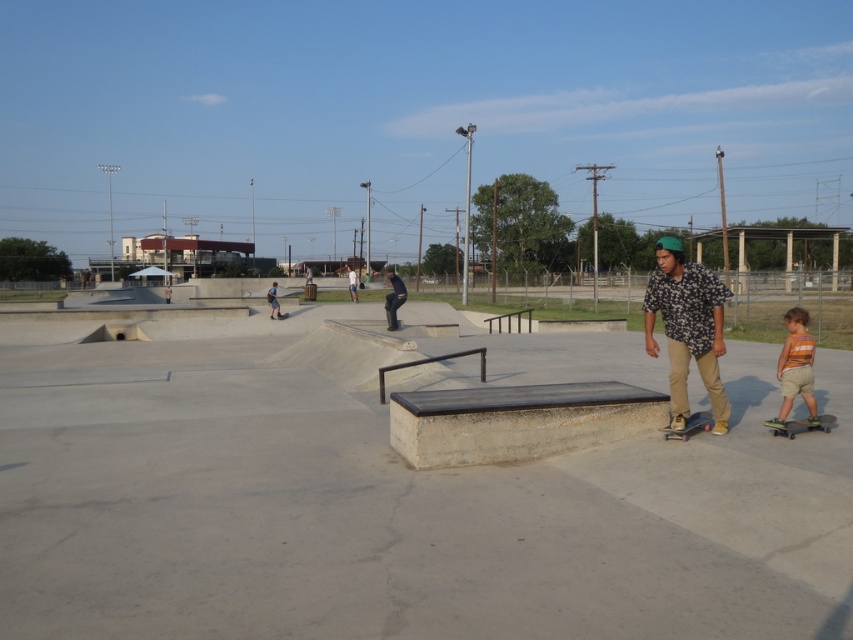
Question: Which of the following is the farthest from the observer?

Choices:
 (A) concrete skate park at center
 (B) green rubber skateboard at lower right
 (C) matte black skateboarder at center

Answer: (C)

Question: Can you confirm if floral shirt at center is bigger than striped cotton shirt at lower right?

Choices:
 (A) yes
 (B) no

Answer: (A)

Question: Which point is closer to the camera?

Choices:
 (A) striped cotton shirt at lower right
 (B) green rubber skateboard at lower right

Answer: (B)

Question: Is striped cotton shirt at lower right above matte black skateboarder at center?

Choices:
 (A) no
 (B) yes

Answer: (A)

Question: Considering the real-world distances, which object is farthest from the black matte skateboard at lower right?

Choices:
 (A) green rubber skateboard at lower right
 (B) matte black skateboarder at center
 (C) striped cotton shirt at lower right
 (D) concrete skate park at center

Answer: (B)

Question: Is concrete skate park at center above black matte skateboard at lower right?

Choices:
 (A) yes
 (B) no

Answer: (A)